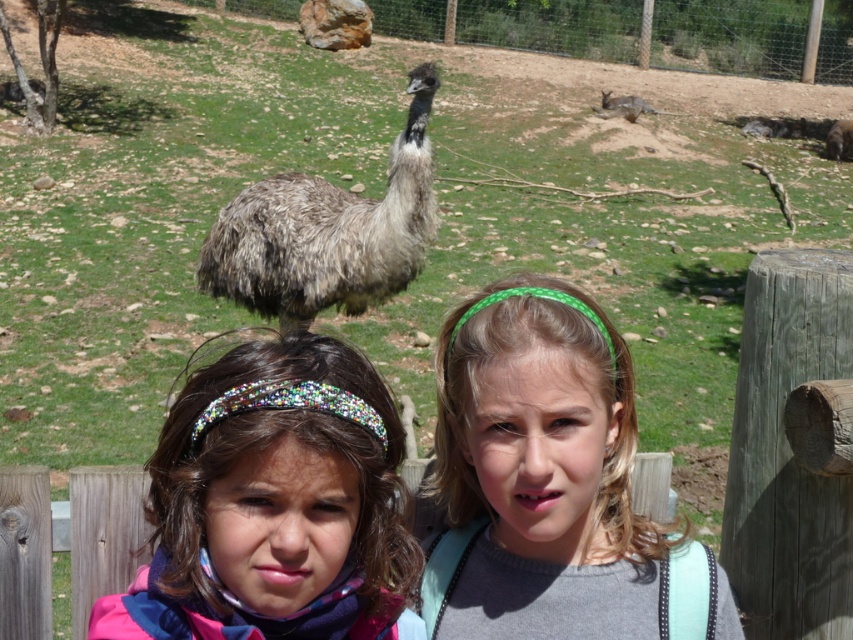
Question: Considering the relative positions of matte gray shirt at center and multicolored sequined headband at center in the image provided, where is matte gray shirt at center located with respect to multicolored sequined headband at center?

Choices:
 (A) above
 (B) below

Answer: (A)

Question: Which object is positioned farthest from the multicolored sequined headband at center?

Choices:
 (A) fuzzy brown animal at center
 (B) fuzzy gray kangaroo at upper right

Answer: (B)

Question: Observing the image, what is the correct spatial positioning of multicolored sequined headband at center in reference to brown fuzzy ostrich at center?

Choices:
 (A) above
 (B) below

Answer: (B)

Question: Which point is farther to the camera?

Choices:
 (A) matte gray shirt at center
 (B) multicolored sequined headband at center
 (C) wooden fence at lower center

Answer: (C)

Question: Which of the following is the farthest from the observer?

Choices:
 (A) (461, 586)
 (B) (33, 600)
 (C) (844, 140)

Answer: (C)

Question: Observing the image, what is the correct spatial positioning of multicolored sequined headband at center in reference to fuzzy gray wallaby at upper right?

Choices:
 (A) above
 (B) below

Answer: (B)